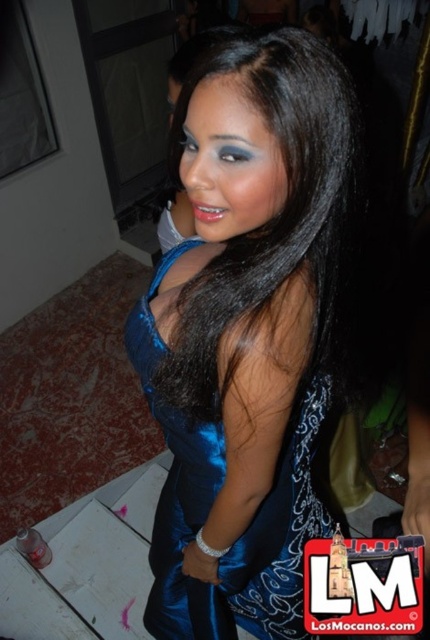
Is point (331, 266) positioned behind point (159, 604)?

No.

Does satin black hair at center have a lesser height compared to satin blue dress at center?

Correct, satin black hair at center is not as tall as satin blue dress at center.

Is point (359, 156) more distant than point (294, 513)?

No, (359, 156) is in front of (294, 513).

This screenshot has height=640, width=430. Find the location of `satin black hair at center`. satin black hair at center is located at coordinates (276, 212).